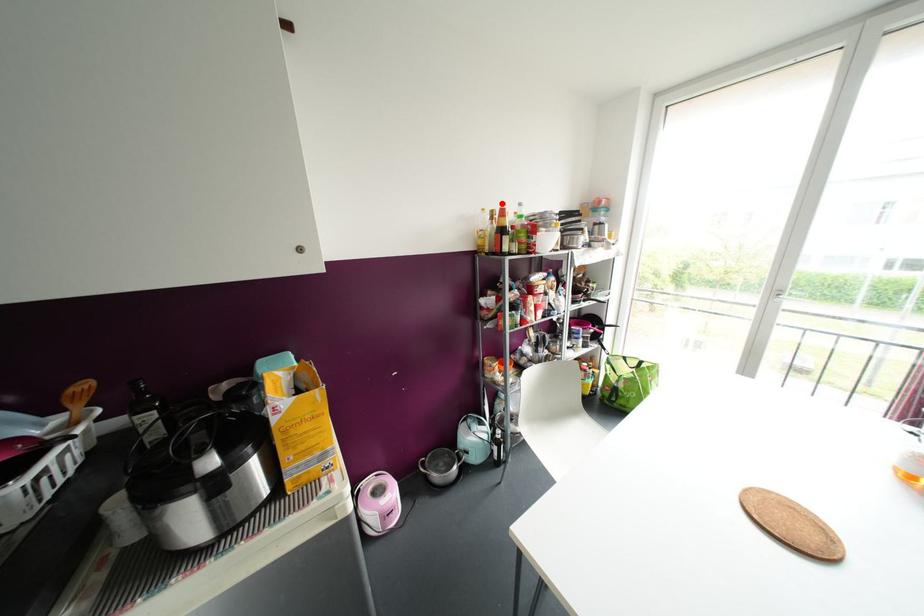
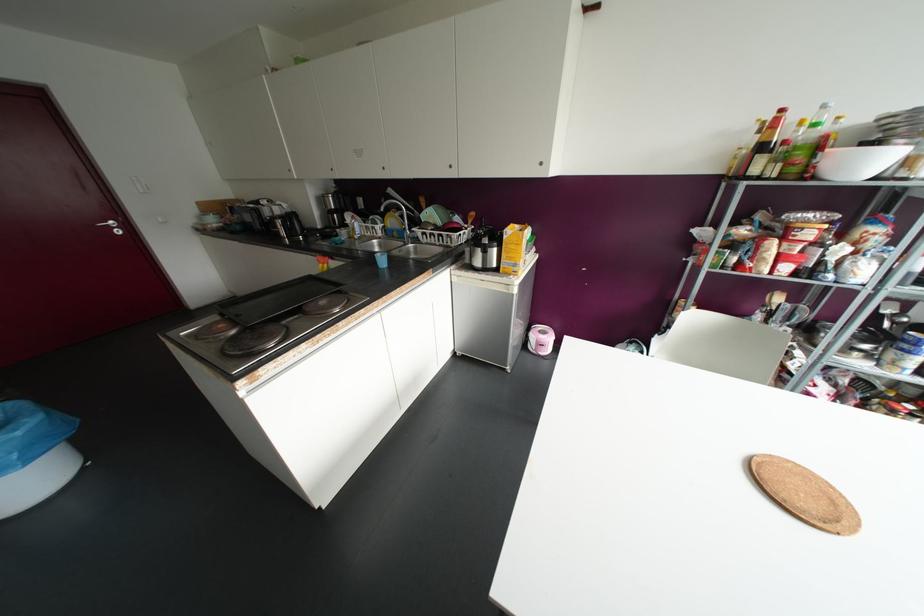
The point at the highlighted location is marked in the first image. Where is the corresponding point in the second image?

(781, 110)